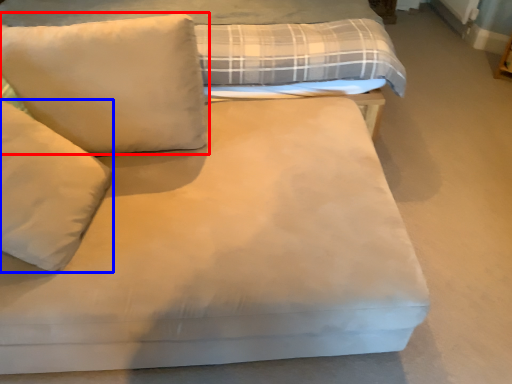
Question: Which object appears closest to the camera in this image, pillow (highlighted by a red box) or pillow (highlighted by a blue box)?

Choices:
 (A) pillow
 (B) pillow

Answer: (B)